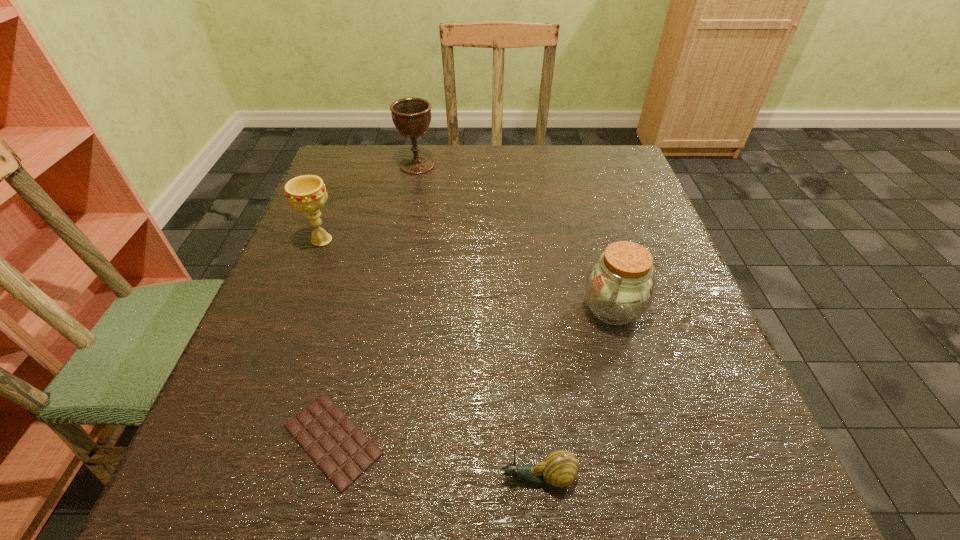
Identify the location of vacant space positioned 0.370m on the back of the second farthest object. This screenshot has width=960, height=540. (358, 147).

Where is `free space located on the back of the third farthest object`? The width and height of the screenshot is (960, 540). free space located on the back of the third farthest object is located at coordinates point(593,242).

The height and width of the screenshot is (540, 960). I want to click on vacant area situated 0.380m on the front-facing side of the fourth tallest object, so click(222, 478).

What are the coordinates of `free region located 0.230m on the front-facing side of the fourth tallest object` in the screenshot? It's located at (330, 478).

The width and height of the screenshot is (960, 540). I want to click on free space located on the front-facing side of the fourth tallest object, so click(374, 478).

The image size is (960, 540). I want to click on vacant space situated on the back of the chocolate bar, so click(358, 334).

At what (x,y) coordinates should I click in order to perform the action: click on object located in the far edge section of the desktop. Please return your answer as a coordinate pair (x, y). The height and width of the screenshot is (540, 960). Looking at the image, I should click on (411, 116).

The image size is (960, 540). What are the coordinates of `escargot located at the near edge` in the screenshot? It's located at (559, 469).

The image size is (960, 540). In order to click on chocolate bar positioned at the near edge in this screenshot , I will do `click(340, 449)`.

The image size is (960, 540). I want to click on chalice located in the left edge section of the desktop, so tap(307, 193).